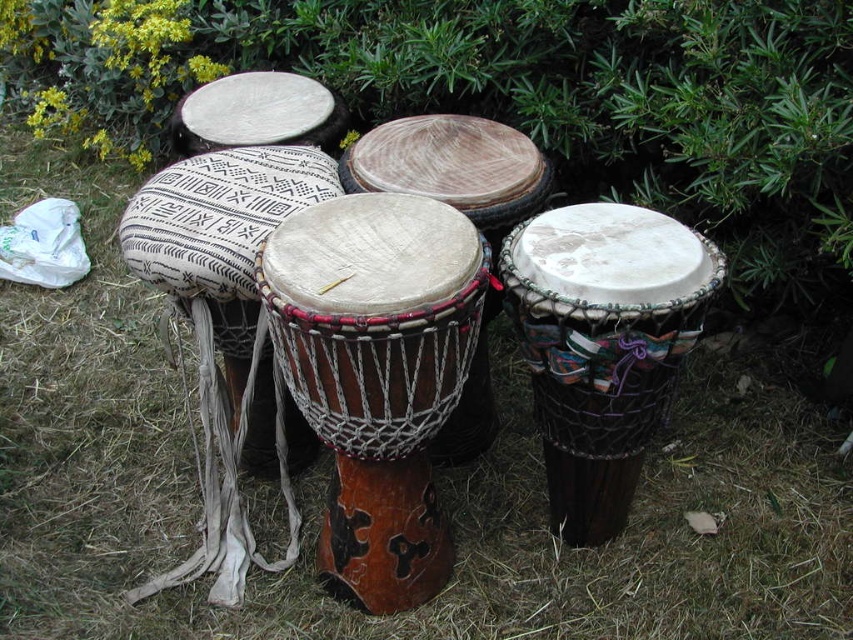
Question: Can you confirm if brown wooden drum at center is positioned to the right of white fabric drum at upper center?

Choices:
 (A) no
 (B) yes

Answer: (B)

Question: Which point is farther to the camera?

Choices:
 (A) (416, 396)
 (B) (247, 372)

Answer: (B)

Question: Which point appears farthest from the camera in this image?

Choices:
 (A) (314, 280)
 (B) (181, 122)
 (C) (242, 280)
 (D) (566, 508)

Answer: (B)

Question: Which is farther from the brown wooden drum at center?

Choices:
 (A) white fabric-covered drum at center-left
 (B) white fabric drum at upper center

Answer: (B)

Question: Is brown wooden drum at center thinner than natural wood drum at center?

Choices:
 (A) no
 (B) yes

Answer: (B)

Question: From the image, what is the correct spatial relationship of natural wood drum at center in relation to white fabric-covered drum at center-left?

Choices:
 (A) above
 (B) below

Answer: (B)